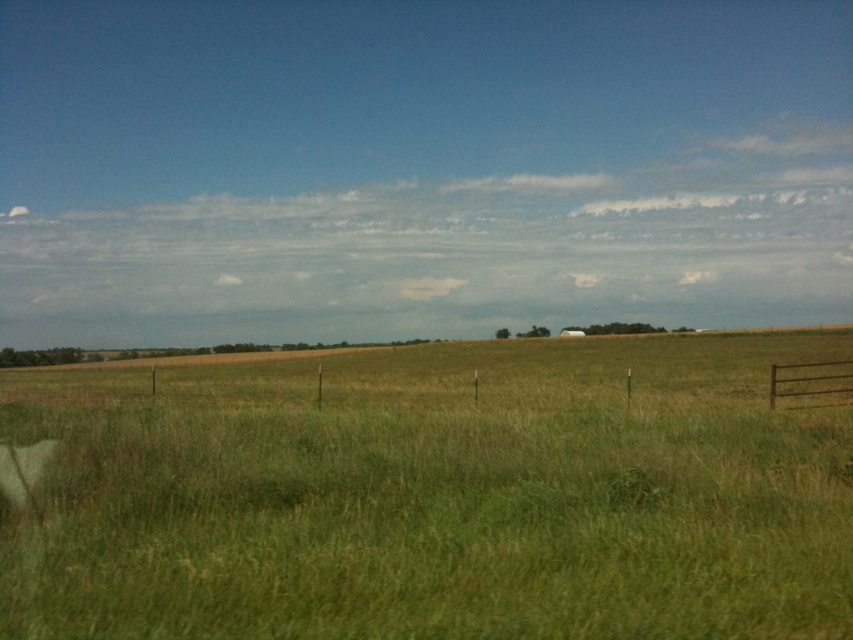
You are a farmer checking the field layout. You see the green grassy pasture at center and the rusty metal fence at right. Which one is positioned to the left side of the other?

The green grassy pasture at center is to the left of the rusty metal fence at right.